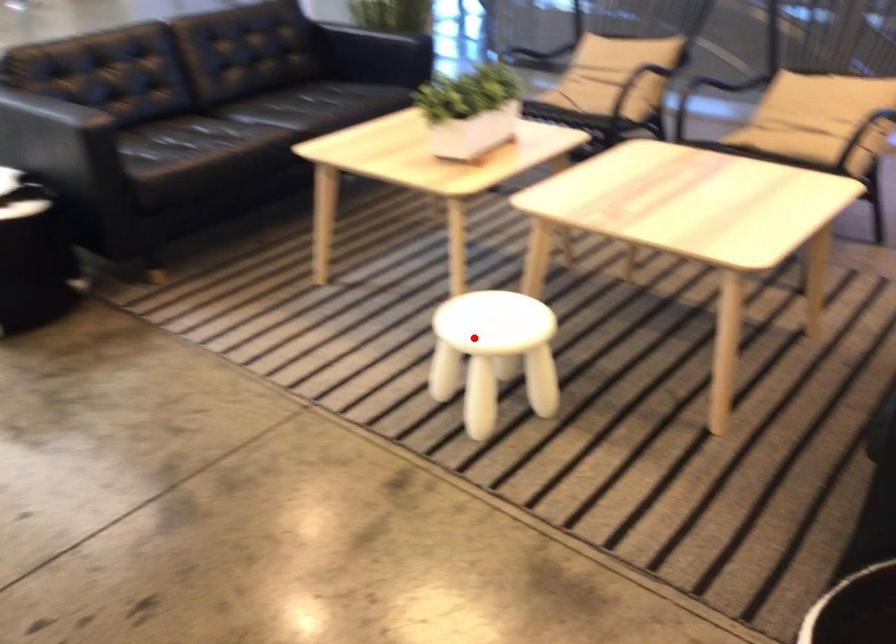
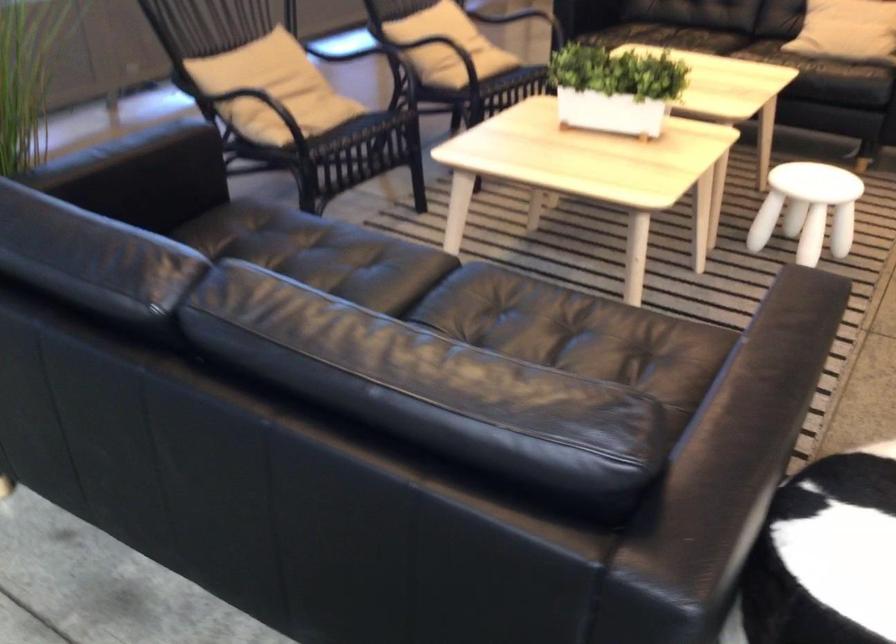
Question: A red point is marked in image1. In image2, is the corresponding 3D point closer to the camera or farther? Reply with the corresponding letter.

Choices:
 (A) The corresponding 3D point is closer.
 (B) The corresponding 3D point is farther.

Answer: (B)